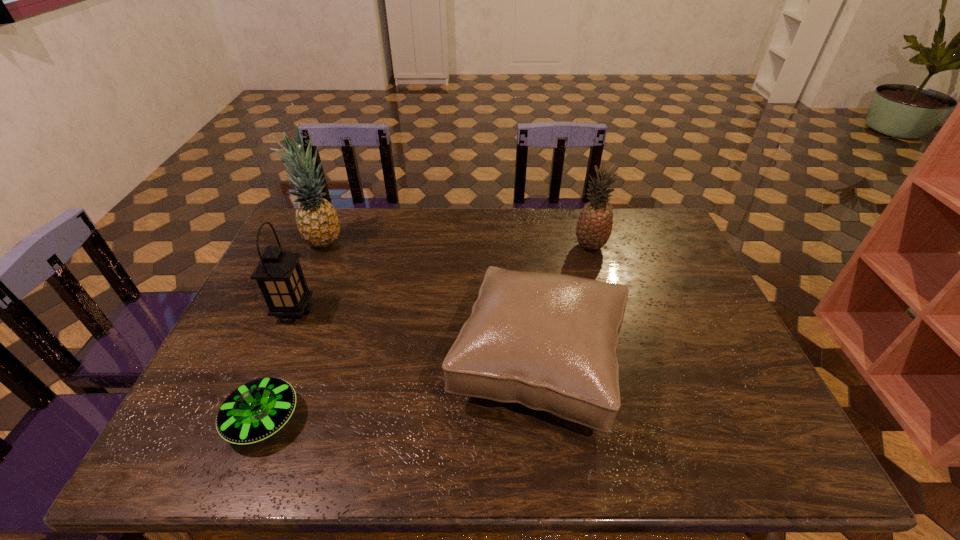
Where is `the tallest object`? The width and height of the screenshot is (960, 540). the tallest object is located at coordinates (317, 221).

At what (x,y) coordinates should I click in order to perform the action: click on the left pineapple. Please return your answer as a coordinate pair (x, y). Looking at the image, I should click on (317, 221).

This screenshot has height=540, width=960. In order to click on the right pineapple in this screenshot , I will do `click(594, 225)`.

You are a GUI agent. You are given a task and a screenshot of the screen. Output one action in this format:
    pyautogui.click(x=<x>, y=<y>)
    Task: Click on the lantern
    The width and height of the screenshot is (960, 540).
    Given the screenshot: What is the action you would take?
    pyautogui.click(x=279, y=275)

Locate an element on the screen. cushion is located at coordinates (548, 341).

At what (x,y) coordinates should I click in order to perform the action: click on saucer. Please return your answer as a coordinate pair (x, y). This screenshot has height=540, width=960. Looking at the image, I should click on (256, 410).

Where is `vacant region located 0.370m on the right of the left pineapple`? The width and height of the screenshot is (960, 540). vacant region located 0.370m on the right of the left pineapple is located at coordinates (453, 241).

Where is `free region located on the right of the shorter pineapple`? The height and width of the screenshot is (540, 960). free region located on the right of the shorter pineapple is located at coordinates (625, 246).

This screenshot has width=960, height=540. In order to click on blank space located on the right of the lantern in this screenshot , I will do `click(444, 312)`.

Find the location of `vacant space situated 0.370m on the left of the cushion`. vacant space situated 0.370m on the left of the cushion is located at coordinates (300, 364).